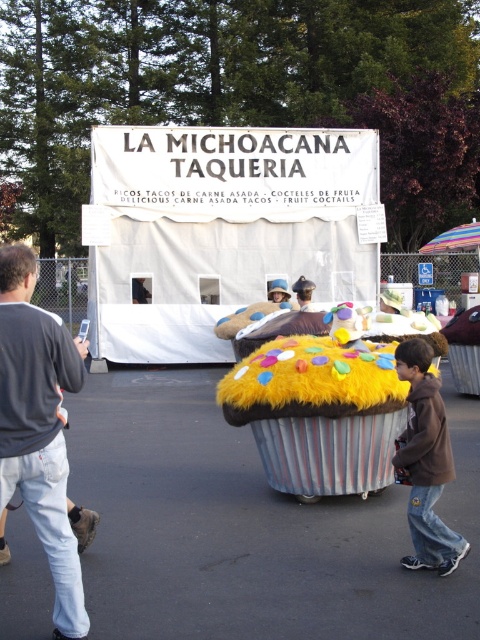
How much distance is there between gray sweater at left and brown fuzzy jacket at lower right?

1.96 meters

Where is `gray sweater at left`? The width and height of the screenshot is (480, 640). gray sweater at left is located at coordinates (38, 428).

Where is `gray sweater at left`? The image size is (480, 640). gray sweater at left is located at coordinates (38, 428).